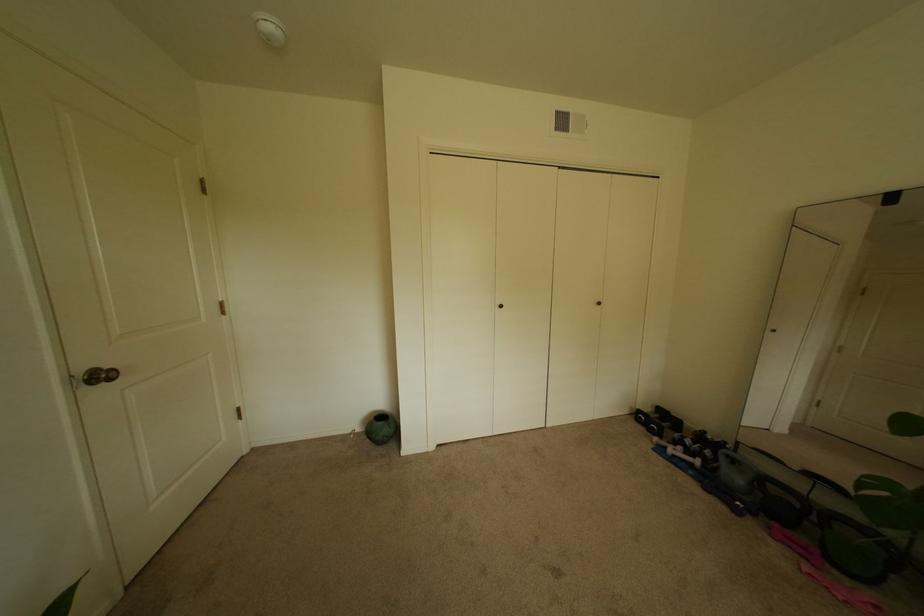
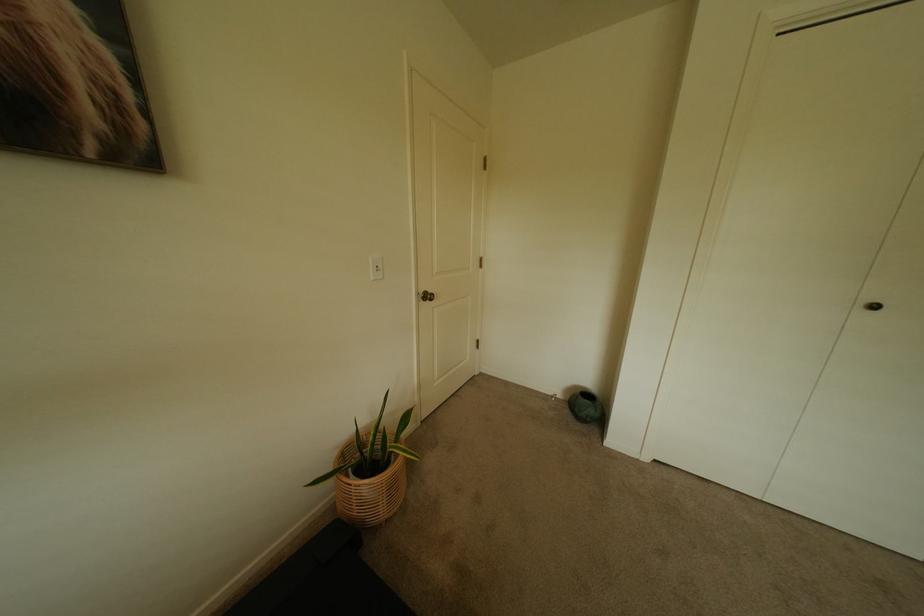
Question: The camera is either moving clockwise (left) or counter-clockwise (right) around the object. The first image is from the beginning of the video and the second image is from the end. Is the camera moving left or right when shooting the video?

Choices:
 (A) Left
 (B) Right

Answer: (B)